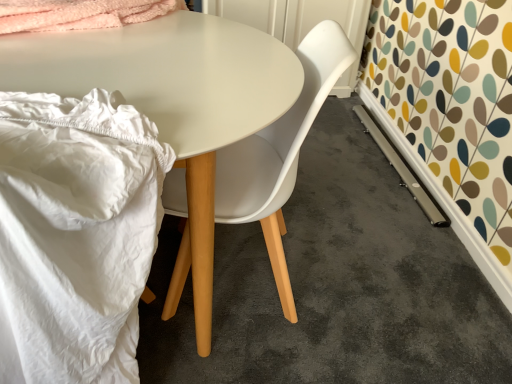
Question: Considering the relative positions of white fabric at left and white plastic chair at center in the image provided, is white fabric at left to the left or to the right of white plastic chair at center?

Choices:
 (A) left
 (B) right

Answer: (A)

Question: From a real-world perspective, is white fabric at left positioned above or below white plastic chair at center?

Choices:
 (A) below
 (B) above

Answer: (B)

Question: Estimate the real-world distances between objects in this image. Which object is farther from the white fabric at left?

Choices:
 (A) white glossy table at center
 (B) white plastic chair at center

Answer: (B)

Question: Estimate the real-world distances between objects in this image. Which object is farther from the white fabric at left?

Choices:
 (A) white plastic chair at center
 (B) white glossy table at center

Answer: (A)